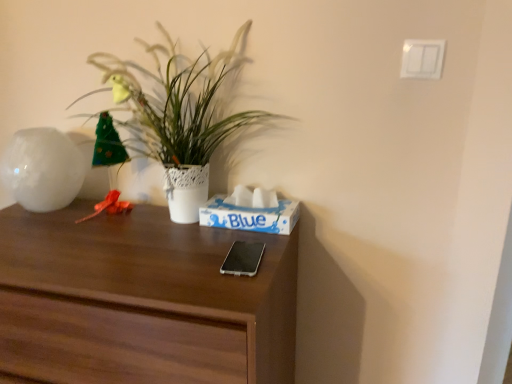
Question: From a real-world perspective, is blue paper tissue box at center on white glossy vase at left?

Choices:
 (A) no
 (B) yes

Answer: (A)

Question: Can you confirm if blue paper tissue box at center is taller than white glossy vase at left?

Choices:
 (A) yes
 (B) no

Answer: (B)

Question: Is blue paper tissue box at center far from white glossy vase at left?

Choices:
 (A) no
 (B) yes

Answer: (A)

Question: Does blue paper tissue box at center touch white glossy vase at left?

Choices:
 (A) no
 (B) yes

Answer: (A)

Question: Would you say blue paper tissue box at center contains white glossy vase at left?

Choices:
 (A) no
 (B) yes

Answer: (A)

Question: Considering the positions of blue paper tissue box at center and white glossy vase at left in the image, is blue paper tissue box at center wider or thinner than white glossy vase at left?

Choices:
 (A) thin
 (B) wide

Answer: (A)

Question: Relative to white glossy vase at left, is blue paper tissue box at center in front or behind?

Choices:
 (A) behind
 (B) front

Answer: (B)

Question: Is blue paper tissue box at center inside the boundaries of white glossy vase at left, or outside?

Choices:
 (A) outside
 (B) inside

Answer: (A)

Question: Is point (216, 226) closer or farther from the camera than point (25, 178)?

Choices:
 (A) farther
 (B) closer

Answer: (B)

Question: Based on their positions, is white lace pot at upper left located to the left or right of white glossy vase at left?

Choices:
 (A) left
 (B) right

Answer: (B)

Question: Is white lace pot at upper left bigger or smaller than white glossy vase at left?

Choices:
 (A) small
 (B) big

Answer: (B)

Question: Is point (182, 109) closer or farther from the camera than point (82, 157)?

Choices:
 (A) farther
 (B) closer

Answer: (B)

Question: From the image's perspective, relative to white glossy vase at left, is white lace pot at upper left above or below?

Choices:
 (A) below
 (B) above

Answer: (B)

Question: From a real-world perspective, is silver metallic phone at center physically located above or below white lace pot at upper left?

Choices:
 (A) above
 (B) below

Answer: (B)

Question: In the image, is silver metallic phone at center positioned in front of or behind white lace pot at upper left?

Choices:
 (A) behind
 (B) front

Answer: (B)